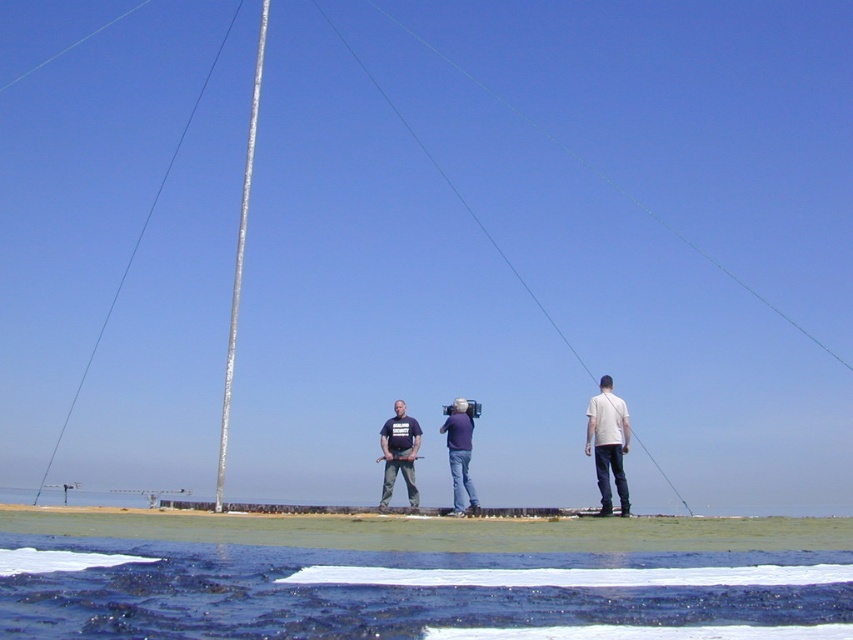
Question: Which object is positioned closest to the silver reflective mast at center?

Choices:
 (A) dark blue t-shirt at center
 (B) purple fabric camera at center

Answer: (B)

Question: Observing the image, what is the correct spatial positioning of dark blue water at lower center in reference to silver metallic pole at left?

Choices:
 (A) left
 (B) right

Answer: (B)

Question: In this image, where is dark blue t-shirt at center located relative to purple fabric camera at center?

Choices:
 (A) left
 (B) right

Answer: (A)

Question: Estimate the real-world distances between objects in this image. Which object is farther from the silver reflective mast at center?

Choices:
 (A) purple fabric camera at center
 (B) silver metallic pole at left

Answer: (B)

Question: Among these points, which one is farthest from the camera?

Choices:
 (A) (96, 339)
 (B) (451, 416)
 (C) (465, 634)
 (D) (416, 422)

Answer: (A)

Question: Can you confirm if silver reflective mast at center is bigger than dark blue t-shirt at center?

Choices:
 (A) yes
 (B) no

Answer: (A)